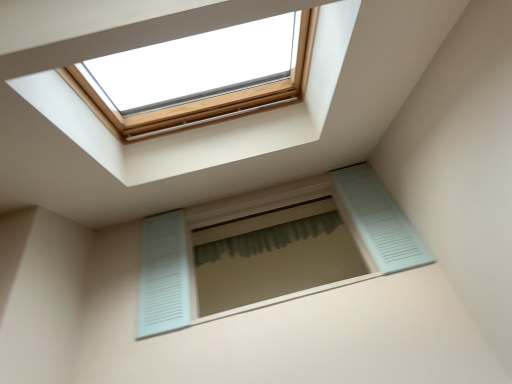
The height and width of the screenshot is (384, 512). I want to click on light blue louvered window at center, so click(x=267, y=210).

What do you see at coordinates (267, 210) in the screenshot? I see `light blue louvered window at center` at bounding box center [267, 210].

Measure the distance between light blue louvered window at center and camera.

They are 7.71 feet apart.

What is the approximate height of light blue louvered window at center?

light blue louvered window at center is 3.32 feet in height.

This screenshot has height=384, width=512. Describe the element at coordinates (267, 238) in the screenshot. I see `green fabric shower curtain at center` at that location.

This screenshot has height=384, width=512. What are the coordinates of `green fabric shower curtain at center` in the screenshot? It's located at (267, 238).

What is the approximate height of green fabric shower curtain at center?

9.40 inches.

Identify the location of light blue louvered window at center. Image resolution: width=512 pixels, height=384 pixels. (267, 210).

Between light blue louvered window at center and green fabric shower curtain at center, which one appears on the right side from the viewer's perspective?

From the viewer's perspective, green fabric shower curtain at center appears more on the right side.

Does light blue louvered window at center come behind green fabric shower curtain at center?

No.

Which is further, (382, 219) or (245, 243)?

The point (245, 243) is farther from the camera.

From the image's perspective, which is above, light blue louvered window at center or green fabric shower curtain at center?

green fabric shower curtain at center.

From a real-world perspective, which object stands above the other?

From a 3D spatial view, green fabric shower curtain at center is above.

In the scene shown: Considering the sizes of objects light blue louvered window at center and green fabric shower curtain at center in the image provided, who is thinner, light blue louvered window at center or green fabric shower curtain at center?

With smaller width is green fabric shower curtain at center.

Can you confirm if light blue louvered window at center is shorter than green fabric shower curtain at center?

No, light blue louvered window at center is not shorter than green fabric shower curtain at center.

From the picture: Between light blue louvered window at center and green fabric shower curtain at center, which one has smaller size?

green fabric shower curtain at center is smaller.

Would you say green fabric shower curtain at center is part of light blue louvered window at center's contents?

That's incorrect, green fabric shower curtain at center is not inside light blue louvered window at center.

Is there a large distance between light blue louvered window at center and green fabric shower curtain at center?

No, there isn't a large distance between light blue louvered window at center and green fabric shower curtain at center.

Is light blue louvered window at center positioned with its back to green fabric shower curtain at center?

Correct, light blue louvered window at center is looking away from green fabric shower curtain at center.

Can you tell me how much light blue louvered window at center and green fabric shower curtain at center differ in facing direction?

The angular difference between light blue louvered window at center and green fabric shower curtain at center is 0.171 degrees.

Measure the distance from light blue louvered window at center to green fabric shower curtain at center.

light blue louvered window at center and green fabric shower curtain at center are 39.51 centimeters apart.

In order to click on window in front of the green fabric shower curtain at center in this screenshot , I will do `click(267, 210)`.

Can you confirm if green fabric shower curtain at center is positioned to the left of light blue louvered window at center?

In fact, green fabric shower curtain at center is to the right of light blue louvered window at center.

Consider the image. Between green fabric shower curtain at center and light blue louvered window at center, which one is positioned behind?

green fabric shower curtain at center.

Is point (260, 253) farther from viewer compared to point (146, 328)?

Yes, point (260, 253) is behind point (146, 328).

From the image's perspective, is green fabric shower curtain at center above or below light blue louvered window at center?

Based on their image positions, green fabric shower curtain at center is located above light blue louvered window at center.

From a real-world perspective, is green fabric shower curtain at center physically located above or below light blue louvered window at center?

Clearly, from a real-world perspective, green fabric shower curtain at center is above light blue louvered window at center.

In terms of width, does green fabric shower curtain at center look wider or thinner when compared to light blue louvered window at center?

In the image, green fabric shower curtain at center appears to be more narrow than light blue louvered window at center.

From the picture: Who is taller, green fabric shower curtain at center or light blue louvered window at center?

light blue louvered window at center.

Considering the sizes of objects green fabric shower curtain at center and light blue louvered window at center in the image provided, who is bigger, green fabric shower curtain at center or light blue louvered window at center?

light blue louvered window at center is bigger.

Choose the correct answer: Is green fabric shower curtain at center inside light blue louvered window at center or outside it?

green fabric shower curtain at center is spatially situated outside light blue louvered window at center.

Would you consider green fabric shower curtain at center to be distant from light blue louvered window at center?

No, there isn't a large distance between green fabric shower curtain at center and light blue louvered window at center.

Is green fabric shower curtain at center aimed at light blue louvered window at center?

Yes, green fabric shower curtain at center is aimed at light blue louvered window at center.

Locate an element on the screen. shower curtain lying on the right of light blue louvered window at center is located at coordinates (267, 238).

In order to click on window in front of the green fabric shower curtain at center in this screenshot , I will do `click(267, 210)`.

In the image, there is a green fabric shower curtain at center. What are the coordinates of `window below it (from a real-world perspective)` in the screenshot? It's located at (267, 210).